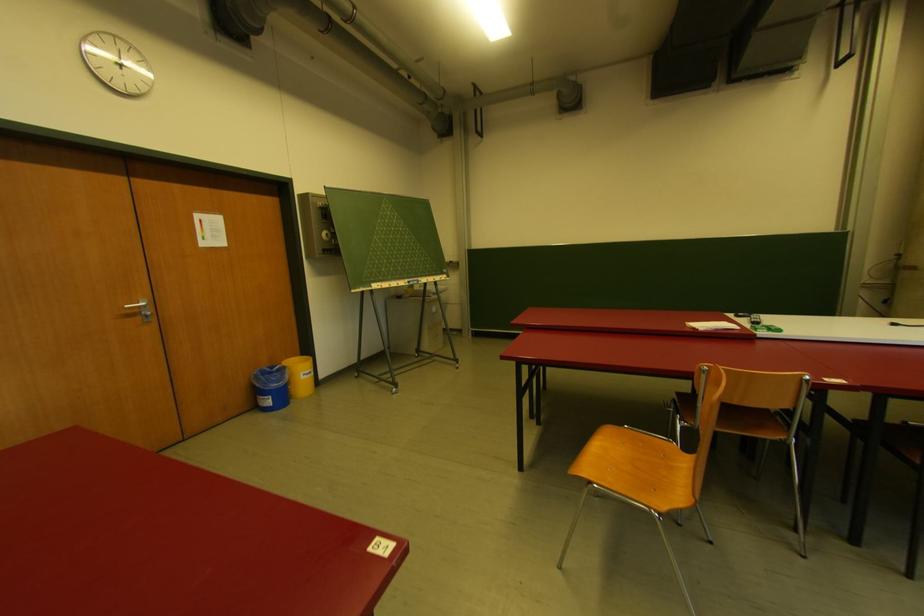
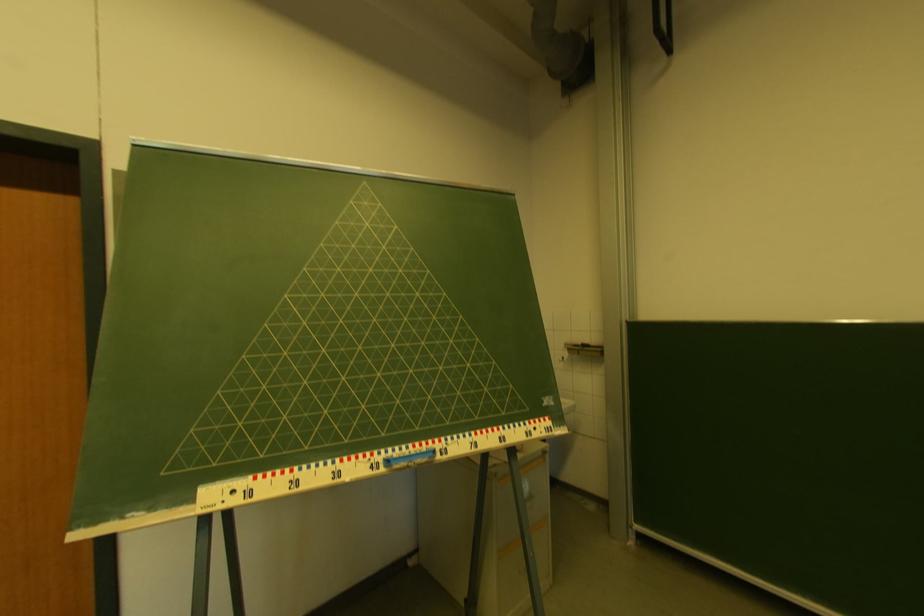
Question: Which direction would the cameraman need to move to produce the second image? Reply with the corresponding letter.

Choices:
 (A) Left
 (B) Right
 (C) Forward
 (D) Backward

Answer: (C)